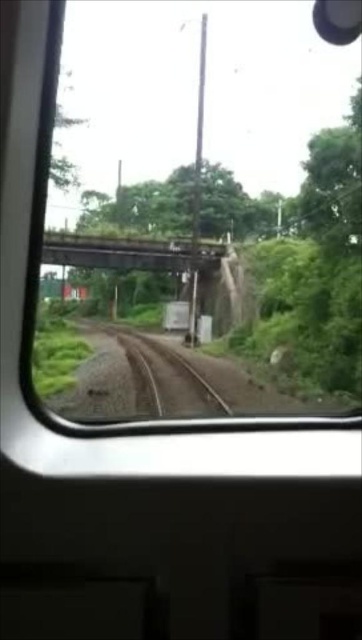
Question: Which point is farther from the camera taking this photo?

Choices:
 (A) (132, 364)
 (B) (48, 257)

Answer: (B)

Question: Can you confirm if brown gravel train track at center is wider than metal bridge at center?

Choices:
 (A) yes
 (B) no

Answer: (B)

Question: Among these points, which one is nearest to the camera?

Choices:
 (A) (114, 324)
 (B) (191, 248)

Answer: (B)

Question: Is brown gravel train track at center to the left of metal bridge at center from the viewer's perspective?

Choices:
 (A) yes
 (B) no

Answer: (B)

Question: Can you confirm if brown gravel train track at center is bigger than metal bridge at center?

Choices:
 (A) yes
 (B) no

Answer: (B)